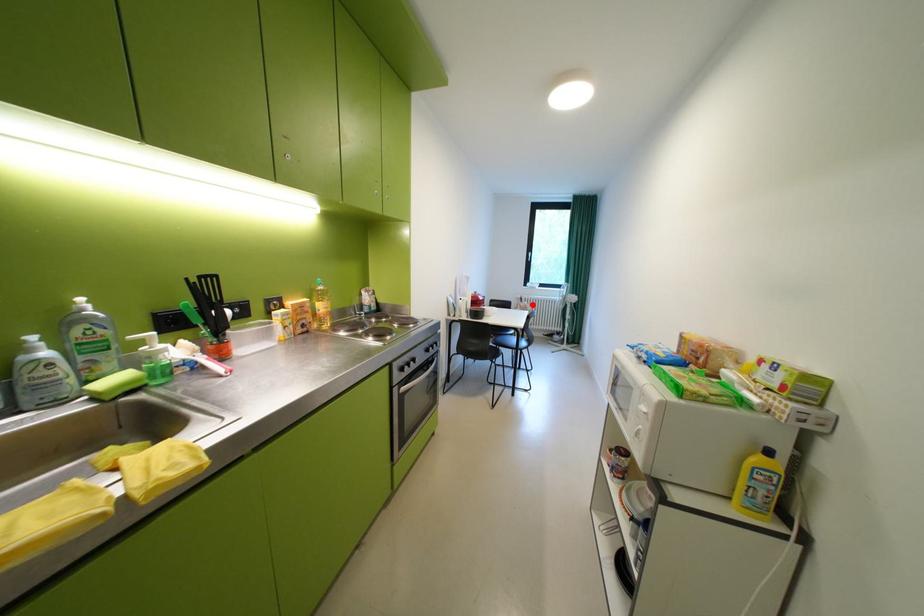
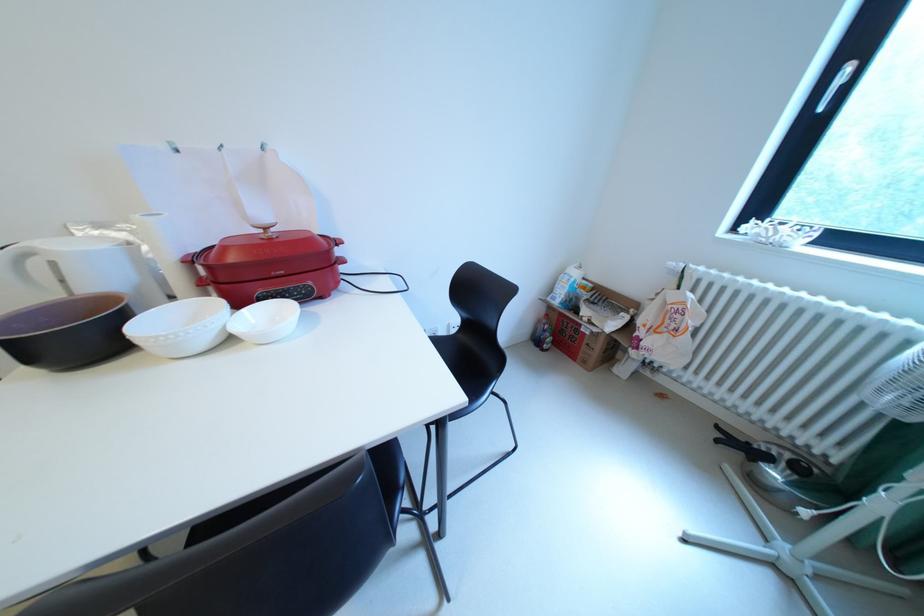
Find the pixel in the second image that matches the highlighted location in the first image.

(682, 297)